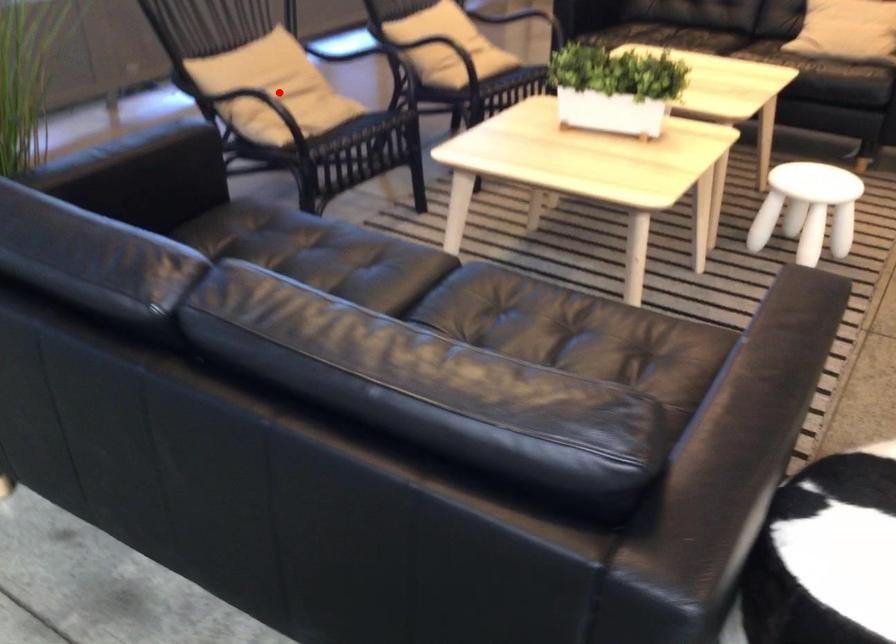
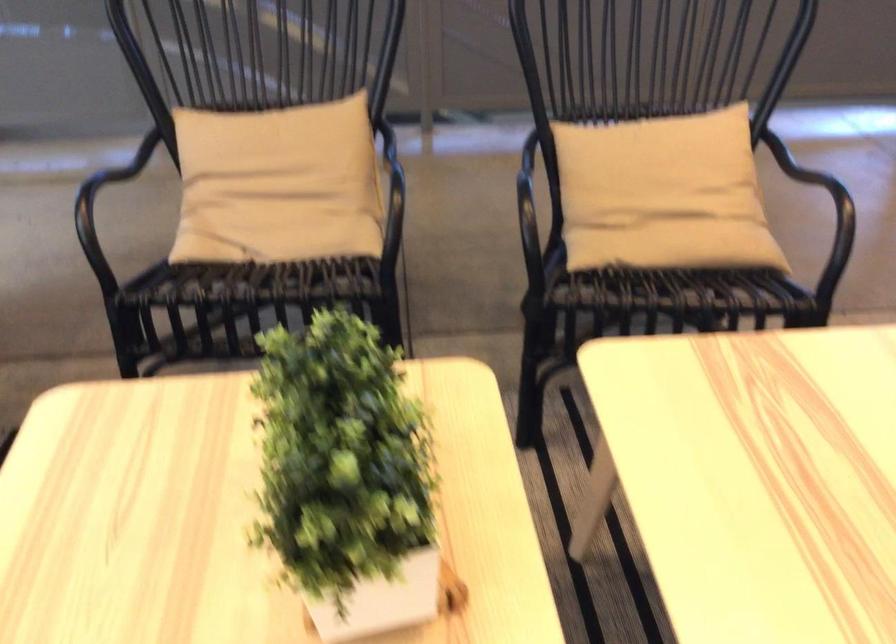
Where in the second image is the point corresponding to the highlighted location from the first image?

(278, 184)